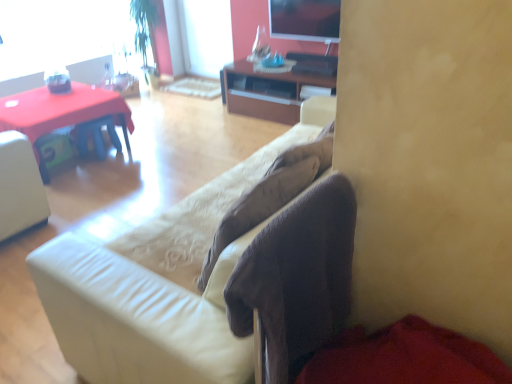
Question: Could you tell me if suede-like beige couch at center is turned towards brown wood cabinet at center?

Choices:
 (A) no
 (B) yes

Answer: (A)

Question: Is brown wood cabinet at center at the back of suede-like beige couch at center?

Choices:
 (A) yes
 (B) no

Answer: (B)

Question: Is suede-like beige couch at center positioned before brown wood cabinet at center?

Choices:
 (A) yes
 (B) no

Answer: (A)

Question: From a real-world perspective, is suede-like beige couch at center positioned under brown wood cabinet at center based on gravity?

Choices:
 (A) no
 (B) yes

Answer: (A)

Question: Is suede-like beige couch at center bigger than brown wood cabinet at center?

Choices:
 (A) no
 (B) yes

Answer: (B)

Question: Is suede-like beige couch at center shorter than brown wood cabinet at center?

Choices:
 (A) yes
 (B) no

Answer: (B)

Question: Is brown wood cabinet at center at the left side of matte plastic desk at left?

Choices:
 (A) yes
 (B) no

Answer: (B)

Question: Is brown wood cabinet at center not within matte plastic desk at left?

Choices:
 (A) yes
 (B) no

Answer: (A)

Question: Is brown wood cabinet at center taller than matte plastic desk at left?

Choices:
 (A) no
 (B) yes

Answer: (B)

Question: Could you tell me if brown wood cabinet at center is turned towards matte plastic desk at left?

Choices:
 (A) no
 (B) yes

Answer: (B)

Question: From the image's perspective, is brown wood cabinet at center above matte plastic desk at left?

Choices:
 (A) yes
 (B) no

Answer: (A)

Question: Does brown wood cabinet at center have a smaller size compared to matte plastic desk at left?

Choices:
 (A) no
 (B) yes

Answer: (A)

Question: Does brown wood cabinet at center come in front of suede-like beige couch at center?

Choices:
 (A) yes
 (B) no

Answer: (B)